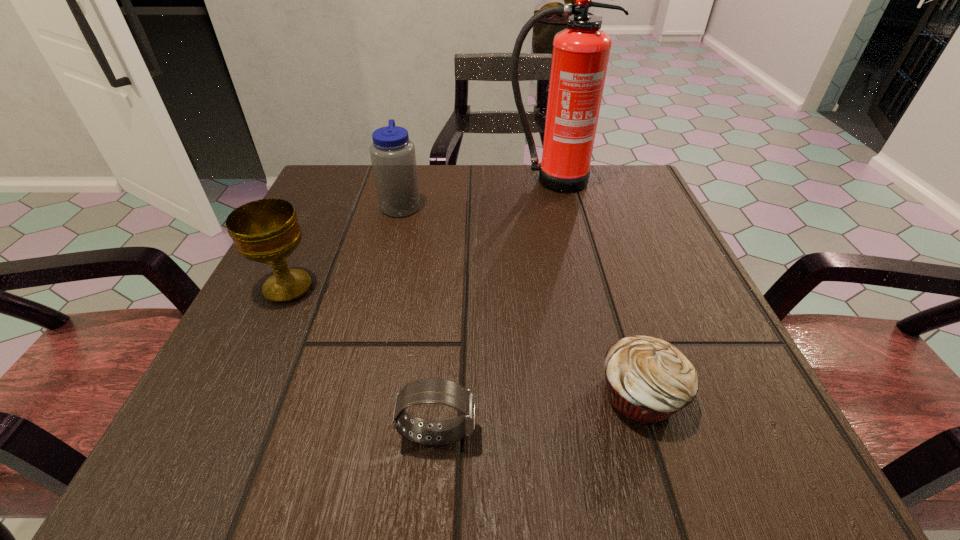
You are a GUI agent. You are given a task and a screenshot of the screen. Output one action in this format:
    pyautogui.click(x=<x>, y=<y>)
    Task: Click on the free spot between the third object from right to left and the tallest object
    This screenshot has width=960, height=540.
    Given the screenshot: What is the action you would take?
    pyautogui.click(x=494, y=307)

Identify the location of vacant space that's between the third object from left to right and the leftmost object. Image resolution: width=960 pixels, height=540 pixels. (362, 360).

The width and height of the screenshot is (960, 540). I want to click on unoccupied area between the third object from right to left and the chalice, so click(x=362, y=360).

The image size is (960, 540). I want to click on free area in between the water bottle and the watch, so click(419, 319).

Identify the location of free area in between the muffin and the tallest object. This screenshot has height=540, width=960. (596, 288).

At what (x,y) coordinates should I click in order to perform the action: click on empty location between the fire extinguisher and the water bottle. Please return your answer as a coordinate pair (x, y). Looking at the image, I should click on (476, 193).

This screenshot has height=540, width=960. I want to click on vacant area that lies between the tallest object and the third object from right to left, so click(x=494, y=307).

Where is `vacant space in between the muffin and the tallest object`? Image resolution: width=960 pixels, height=540 pixels. vacant space in between the muffin and the tallest object is located at coordinates click(596, 288).

Locate which object is the second closest to the third nearest object. Please provide its 2D coordinates. Your answer should be formatted as a tuple, i.e. [(x, y)], where the tuple contains the x and y coordinates of a point satisfying the conditions above.

[(440, 391)]

Locate an element on the screen. The width and height of the screenshot is (960, 540). object identified as the fourth closest to the tallest object is located at coordinates (440, 391).